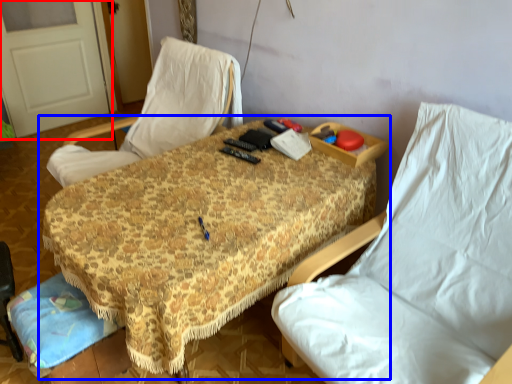
Question: Which point is closer to the camera, door (highlighted by a red box) or table (highlighted by a blue box)?

Choices:
 (A) door
 (B) table

Answer: (B)